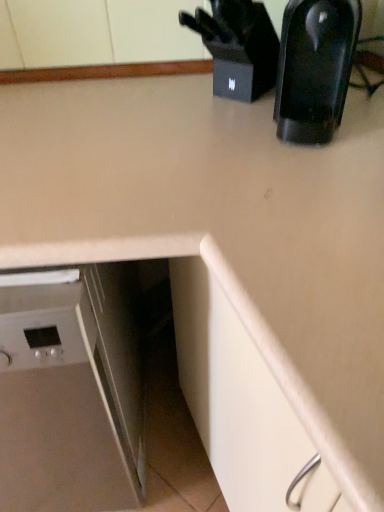
Question: Is white glossy dishwasher at lower left closer to camera compared to black plastic knife block at upper right?

Choices:
 (A) no
 (B) yes

Answer: (B)

Question: Can you confirm if white glossy dishwasher at lower left is wider than black plastic knife block at upper right?

Choices:
 (A) yes
 (B) no

Answer: (A)

Question: Is white glossy dishwasher at lower left shorter than black plastic knife block at upper right?

Choices:
 (A) no
 (B) yes

Answer: (A)

Question: Considering the relative sizes of white glossy dishwasher at lower left and black plastic knife block at upper right in the image provided, is white glossy dishwasher at lower left bigger than black plastic knife block at upper right?

Choices:
 (A) no
 (B) yes

Answer: (B)

Question: Is white glossy dishwasher at lower left smaller than black plastic knife block at upper right?

Choices:
 (A) no
 (B) yes

Answer: (A)

Question: Is white glossy dishwasher at lower left taller or shorter than black plastic knife block at upper right?

Choices:
 (A) short
 (B) tall

Answer: (B)

Question: Considering their positions, is white glossy dishwasher at lower left located in front of or behind black plastic knife block at upper right?

Choices:
 (A) front
 (B) behind

Answer: (A)

Question: From the image's perspective, is white glossy dishwasher at lower left positioned above or below black plastic knife block at upper right?

Choices:
 (A) above
 (B) below

Answer: (B)

Question: Considering the positions of white glossy dishwasher at lower left and black plastic knife block at upper right in the image, is white glossy dishwasher at lower left wider or thinner than black plastic knife block at upper right?

Choices:
 (A) wide
 (B) thin

Answer: (A)

Question: In terms of height, does black plastic knife block at upper right look taller or shorter compared to white glossy dishwasher at lower left?

Choices:
 (A) short
 (B) tall

Answer: (A)

Question: Is point (259, 22) closer or farther from the camera than point (82, 396)?

Choices:
 (A) farther
 (B) closer

Answer: (A)

Question: Looking at the image, does black plastic knife block at upper right seem bigger or smaller compared to white glossy dishwasher at lower left?

Choices:
 (A) big
 (B) small

Answer: (B)

Question: In the image, is black plastic knife block at upper right on the left side or the right side of white glossy dishwasher at lower left?

Choices:
 (A) right
 (B) left

Answer: (A)

Question: Based on their positions, is black plastic knife block at upper right located to the left or right of black glossy coffee maker at upper right?

Choices:
 (A) right
 (B) left

Answer: (B)

Question: In terms of width, does black plastic knife block at upper right look wider or thinner when compared to black glossy coffee maker at upper right?

Choices:
 (A) thin
 (B) wide

Answer: (A)